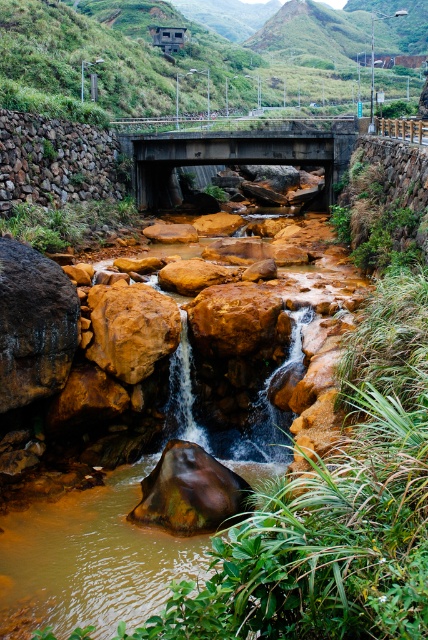
Which is more to the left, concrete bridge at upper center or rustic stone wall at left?

rustic stone wall at left

Between concrete bridge at upper center and rustic stone wall at left, which one is positioned lower?

Positioned lower is rustic stone wall at left.

Locate an element on the screen. The image size is (428, 640). concrete bridge at upper center is located at coordinates (234, 154).